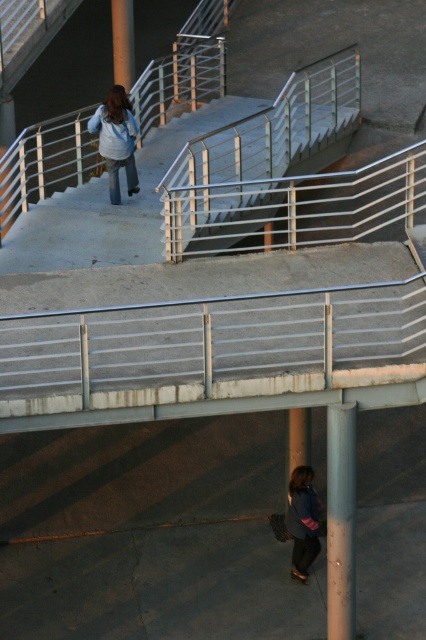
Question: Is metallic silver handrail at upper left bigger than dark blue fabric jacket at lower center?

Choices:
 (A) yes
 (B) no

Answer: (B)

Question: Among these objects, which one is nearest to the camera?

Choices:
 (A) smooth concrete pillar at upper center
 (B) metallic silver handrail at upper left

Answer: (B)

Question: Where is sanded concrete pole at lower right located in relation to dark blue fabric jacket at lower center in the image?

Choices:
 (A) right
 (B) left

Answer: (A)

Question: Among these points, which one is nearest to the camera?

Choices:
 (A) (294, 483)
 (B) (342, 630)
 (C) (109, 104)

Answer: (B)

Question: Does light blue denim jacket at upper center have a greater width compared to dark blue fabric jacket at lower center?

Choices:
 (A) no
 (B) yes

Answer: (B)

Question: Which object is positioned closest to the dark blue fabric jacket at lower center?

Choices:
 (A) smooth concrete pillar at upper center
 (B) sanded concrete pole at lower right
 (C) metallic silver handrail at upper left
 (D) light blue denim jacket at upper center

Answer: (B)